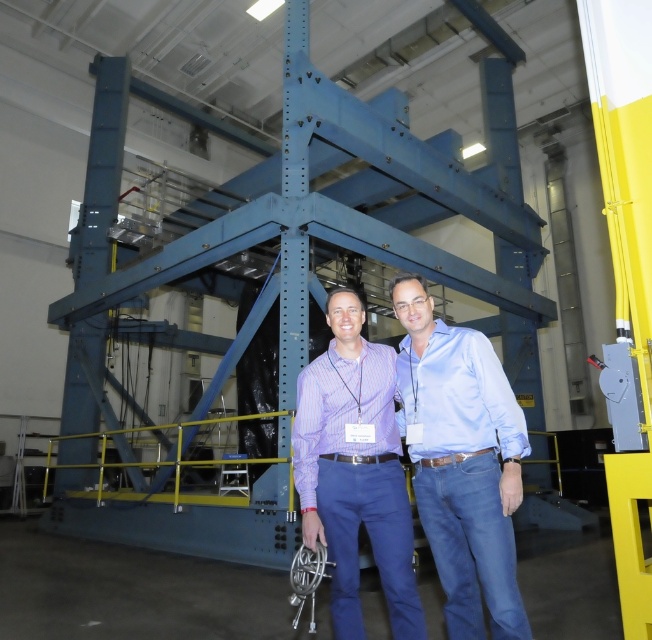
You are standing in the industrial area and need to take a photo of the blue metal structure. Your camera is 6.78 feet away from the blue jeans at center. Is the camera close enough to capture the entire blue metal structure in the frame?

The camera is 6.78 feet away from the blue jeans at center. Since the blue jeans at center are positioned in front of the blue metal structure, the camera is likely positioned at a distance that allows capturing the entire structure, but the exact framing depends on the camera lens used. However, based on the given distance, it might be challenging to capture the entire structure unless using a wide angle lens.

You are an observer in the industrial setting. You see two people wearing blue jeans at center and purple checkered shirt at center. Which clothing item is located to the right of the other?

The blue jeans at center is positioned on the right side of purple checkered shirt at center.